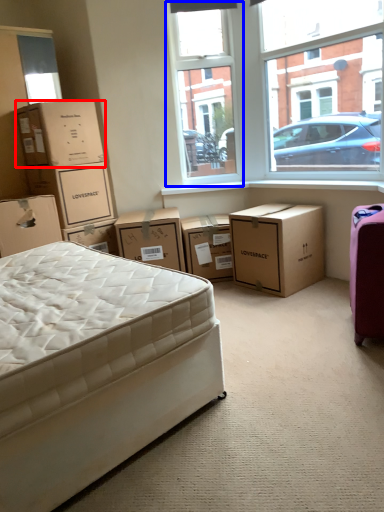
Question: Which object appears farthest to the camera in this image, box (highlighted by a red box) or window screen (highlighted by a blue box)?

Choices:
 (A) box
 (B) window screen

Answer: (B)